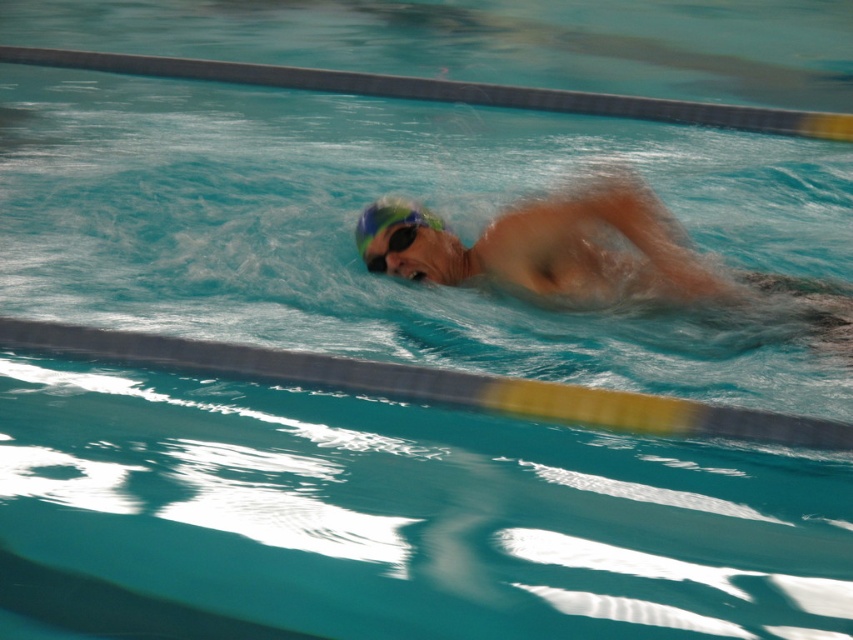
Question: Does matte green swim cap at center come behind blue matte swim cap at center?

Choices:
 (A) yes
 (B) no

Answer: (B)

Question: Is matte green swim cap at center positioned behind blue matte swim cap at center?

Choices:
 (A) yes
 (B) no

Answer: (B)

Question: Which point is closer to the camera taking this photo?

Choices:
 (A) coord(596,230)
 (B) coord(392,205)

Answer: (A)

Question: Does matte green swim cap at center have a lesser width compared to blue matte swim cap at center?

Choices:
 (A) no
 (B) yes

Answer: (A)